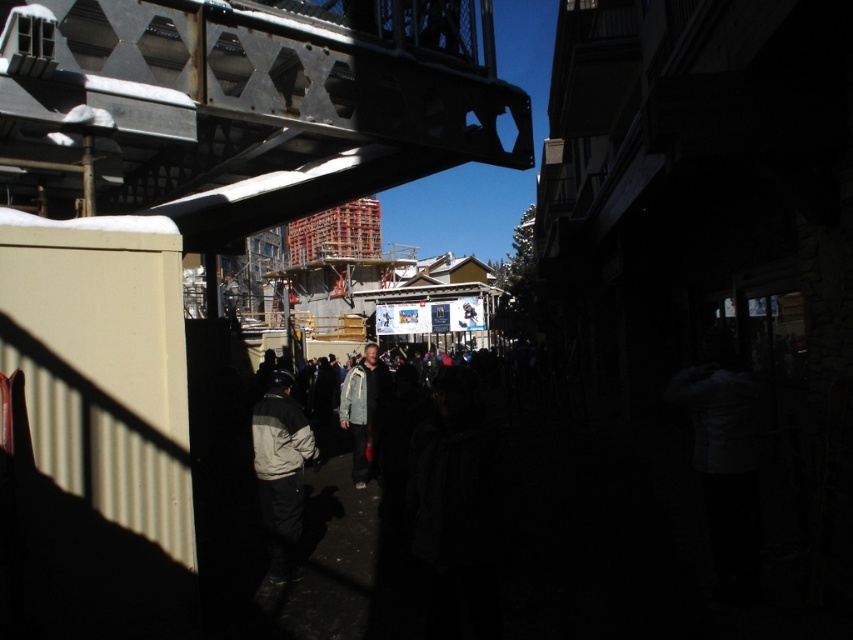
You are standing in the middle of the street in the ski resort town. You see two jackets in the crowd, the gray fleece jacket at center and the light gray jacket at center. Which one is positioned more to the right?

The gray fleece jacket at center is positioned more to the right than the light gray jacket at center.

You are standing at the origin point of the coordinate system in the image. You want to find the gray fleece jacket at center. Which direction should you move to reach it?

The gray fleece jacket at center is located at coordinate point (280, 472), so you should move to the right and slightly downward from the origin to reach it.

You are a photographer trying to capture a candid shot of two people wearing jackets in the crowd. The gray fleece jacket at center and the light gray jacket at center are part of your focus. Given that your camera has a depth of field that can sharply focus on objects within a 2 meter range, will both jackets be in focus at the same time?

The gray fleece jacket at center and the light gray jacket at center are 2.16 meters apart. Since the distance between them exceeds the camera sensor depth of field range of 2 meters, both jackets cannot be in focus simultaneously.